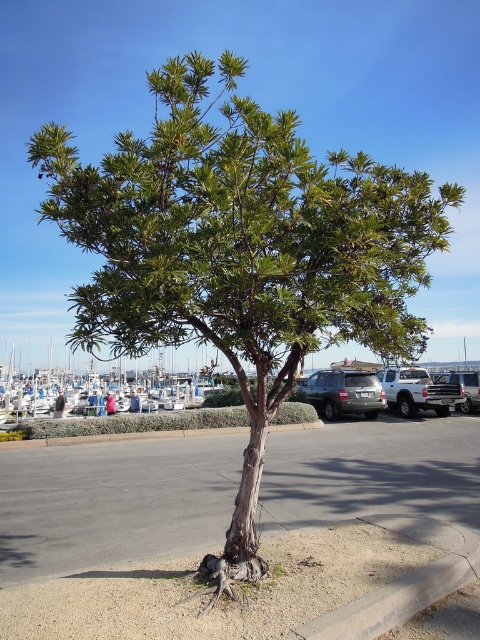
You are standing at the point marked by the coordinates point (344, 392) in the image. What object are you directly facing?

The point (344, 392) marks the satin silver suv at center, so you are directly facing the satin silver suv at center.

You are a delivery driver who needs to park your 2.5 meters wide van in this parking lot. You see the silver metallic truck at right and the satin black suv at right. Which parking space between these two vehicles can accommodate your van?

The satin black suv at right has a greater width than the silver metallic truck at right. Since your van is 2.5 meters wide, you should check the space next to the satin black suv at right as it might be wider. However, without knowing the exact width of the suv, it is recommended to measure the available space before parking.

Looking at this image, you are a delivery person trying to park your vehicle in the parking lot. You see the gray concrete curb at lower right and the satin silver suv at center. Which object is closer to the parking spot where you want to park?

The gray concrete curb at lower right is positioned over the satin silver suv at center, meaning the curb is closer to the parking spot than the SUV. Therefore, you should be cautious of the curb when parking.